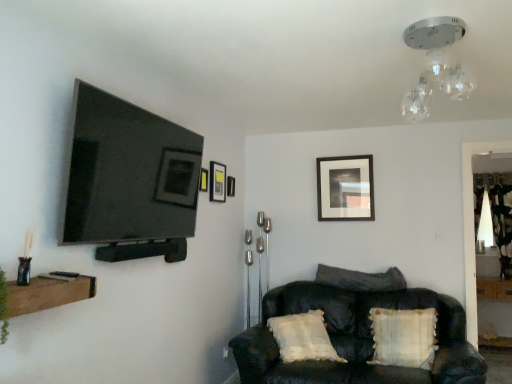
Question: Should I look upward or downward to see white plastic electric outlet at lower center?

Choices:
 (A) down
 (B) up

Answer: (A)

Question: Is wooden shelf at lower left bigger than dark brown leather couch at lower right?

Choices:
 (A) no
 (B) yes

Answer: (A)

Question: Is wooden shelf at lower left positioned before dark brown leather couch at lower right?

Choices:
 (A) no
 (B) yes

Answer: (B)

Question: Is wooden shelf at lower left completely or partially outside of dark brown leather couch at lower right?

Choices:
 (A) yes
 (B) no

Answer: (A)

Question: Does wooden shelf at lower left have a lesser height compared to dark brown leather couch at lower right?

Choices:
 (A) yes
 (B) no

Answer: (A)

Question: Considering the relative sizes of wooden shelf at lower left and dark brown leather couch at lower right in the image provided, is wooden shelf at lower left taller than dark brown leather couch at lower right?

Choices:
 (A) yes
 (B) no

Answer: (B)

Question: Would you consider wooden shelf at lower left to be distant from dark brown leather couch at lower right?

Choices:
 (A) yes
 (B) no

Answer: (A)

Question: From a real-world perspective, is matte black picture frame at upper center, the 4th picture frame positioned from the right, positioned under wooden shelf at lower left based on gravity?

Choices:
 (A) yes
 (B) no

Answer: (B)

Question: Is matte black picture frame at upper center, marked as the fourth picture frame in a back-to-front arrangement, far from wooden shelf at lower left?

Choices:
 (A) yes
 (B) no

Answer: (A)

Question: Is wooden shelf at lower left located within matte black picture frame at upper center, marked as the fourth picture frame in a back-to-front arrangement?

Choices:
 (A) no
 (B) yes

Answer: (A)

Question: Is matte black picture frame at upper center, marked as the fourth picture frame in a back-to-front arrangement, bigger than wooden shelf at lower left?

Choices:
 (A) no
 (B) yes

Answer: (A)

Question: Can you confirm if matte black picture frame at upper center, the 4th picture frame positioned from the right, is shorter than wooden shelf at lower left?

Choices:
 (A) yes
 (B) no

Answer: (B)

Question: From the image's perspective, is matte black picture frame at upper center, marked as the fourth picture frame in a back-to-front arrangement, under wooden shelf at lower left?

Choices:
 (A) yes
 (B) no

Answer: (B)

Question: From the image's perspective, would you say matte black picture frame at upper center, arranged as the 2th picture frame when viewed from the front, is positioned over clear glass light fixture at upper center, which ranks as the first light fixture in front-to-back order?

Choices:
 (A) yes
 (B) no

Answer: (B)